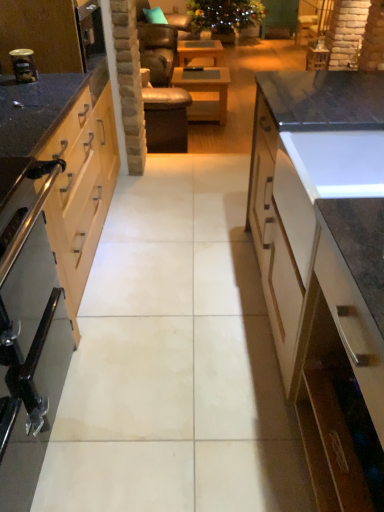
Question: From a real-world perspective, is wooden at center, the first table from the front, above or below metallic silver toaster at left?

Choices:
 (A) below
 (B) above

Answer: (A)

Question: Considering the positions of point (200, 95) and point (36, 18), is point (200, 95) closer or farther from the camera than point (36, 18)?

Choices:
 (A) farther
 (B) closer

Answer: (A)

Question: Which object is the farthest from the white glossy cabinet at right, the 2th cabinetry viewed from the left?

Choices:
 (A) metallic silver canister at left
 (B) wooden table at center, the second table from the bottom
 (C) wooden at center, the first table when ordered from bottom to top
 (D) stainless steel oven at left
 (E) metallic silver toaster at left

Answer: (B)

Question: Which object is positioned closest to the metallic silver toaster at left?

Choices:
 (A) metallic silver canister at left
 (B) light wood cabinet at left, arranged as the 1th cabinetry when viewed from the left
 (C) white glossy cabinet at right, the 2th cabinetry viewed from the left
 (D) wooden table at center, the 2th table viewed from the front
 (E) teal fabric pillow at upper center

Answer: (A)